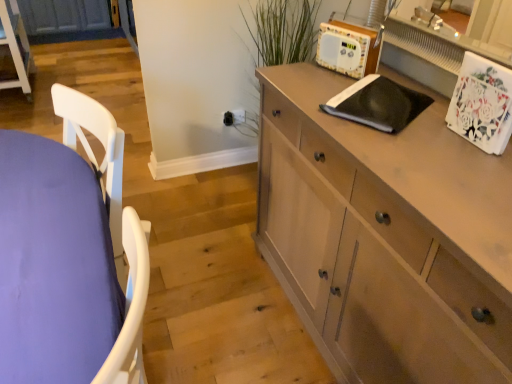
Question: Is green matte plant at upper center far away from purple fabric table at left?

Choices:
 (A) no
 (B) yes

Answer: (B)

Question: Is purple fabric table at left at the back of green matte plant at upper center?

Choices:
 (A) no
 (B) yes

Answer: (A)

Question: Is green matte plant at upper center to the left of purple fabric table at left from the viewer's perspective?

Choices:
 (A) no
 (B) yes

Answer: (A)

Question: Are green matte plant at upper center and purple fabric table at left beside each other?

Choices:
 (A) no
 (B) yes

Answer: (A)

Question: Is green matte plant at upper center at the right side of purple fabric table at left?

Choices:
 (A) yes
 (B) no

Answer: (A)

Question: Can you confirm if green matte plant at upper center is shorter than purple fabric table at left?

Choices:
 (A) yes
 (B) no

Answer: (B)

Question: Can you confirm if wooden radio at upper right is bigger than purple fabric table at left?

Choices:
 (A) no
 (B) yes

Answer: (A)

Question: Does wooden radio at upper right have a greater height compared to purple fabric table at left?

Choices:
 (A) no
 (B) yes

Answer: (A)

Question: Does wooden radio at upper right have a lesser height compared to purple fabric table at left?

Choices:
 (A) no
 (B) yes

Answer: (B)

Question: From a real-world perspective, is wooden radio at upper right physically below purple fabric table at left?

Choices:
 (A) no
 (B) yes

Answer: (A)

Question: Is wooden radio at upper right thinner than purple fabric table at left?

Choices:
 (A) yes
 (B) no

Answer: (A)

Question: Is purple fabric table at left at the back of wooden radio at upper right?

Choices:
 (A) yes
 (B) no

Answer: (B)

Question: Does light brown wood cabinet at lower left have a greater width compared to light brown wood cabinet at right?

Choices:
 (A) yes
 (B) no

Answer: (B)